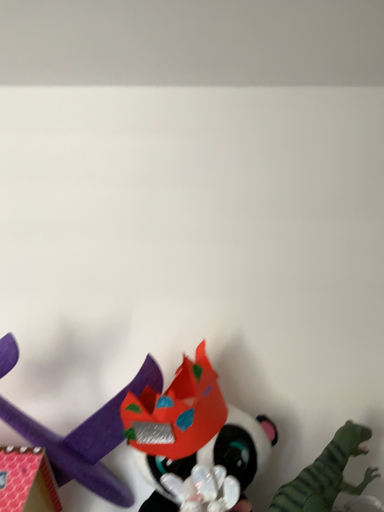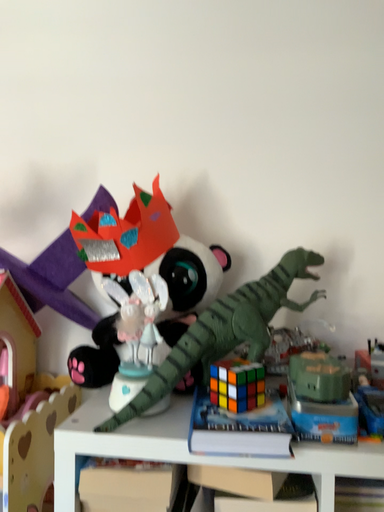
Question: How did the camera likely rotate when shooting the video?

Choices:
 (A) rotated downward
 (B) rotated upward

Answer: (A)